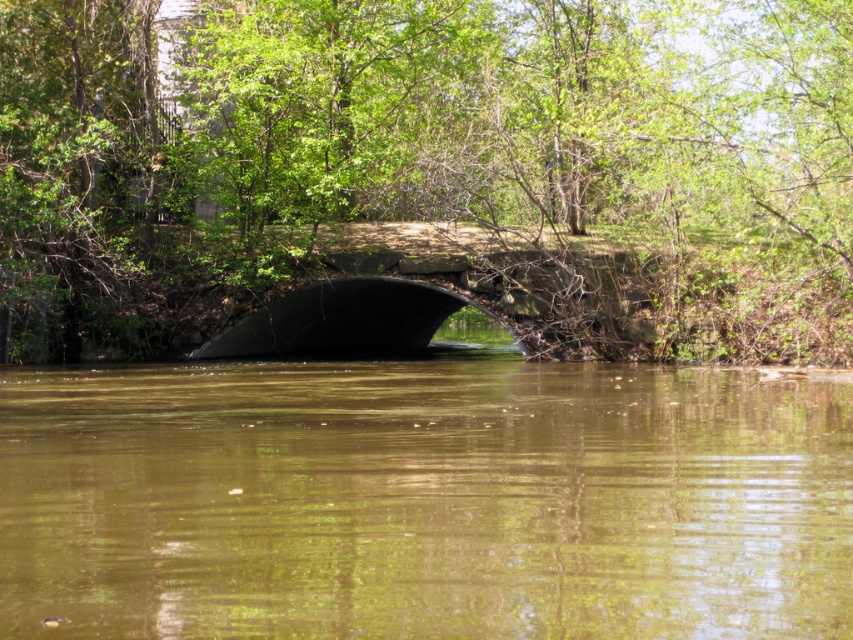
Question: Based on their relative distances, which object is farther from the black rubber bridge at center?

Choices:
 (A) green leafy tree at center
 (B) brown matte water at center

Answer: (B)

Question: Is green leafy tree at center to the right of brown matte water at center from the viewer's perspective?

Choices:
 (A) yes
 (B) no

Answer: (A)

Question: Which of the following is the closest to the observer?

Choices:
 (A) (358, 499)
 (B) (22, 92)
 (C) (280, 308)

Answer: (A)

Question: Is green leafy tree at center below brown matte water at center?

Choices:
 (A) no
 (B) yes

Answer: (A)

Question: Estimate the real-world distances between objects in this image. Which object is closer to the black rubber bridge at center?

Choices:
 (A) green leafy tree at center
 (B) brown matte water at center

Answer: (A)

Question: Does green leafy tree at center appear over brown matte water at center?

Choices:
 (A) yes
 (B) no

Answer: (A)